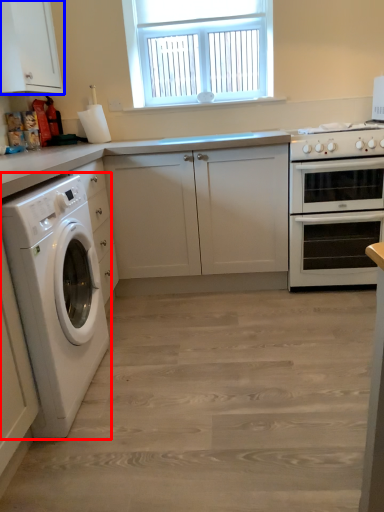
Question: Which of the following is the farthest to the observer, washing machine (highlighted by a red box) or cabinetry (highlighted by a blue box)?

Choices:
 (A) washing machine
 (B) cabinetry

Answer: (B)